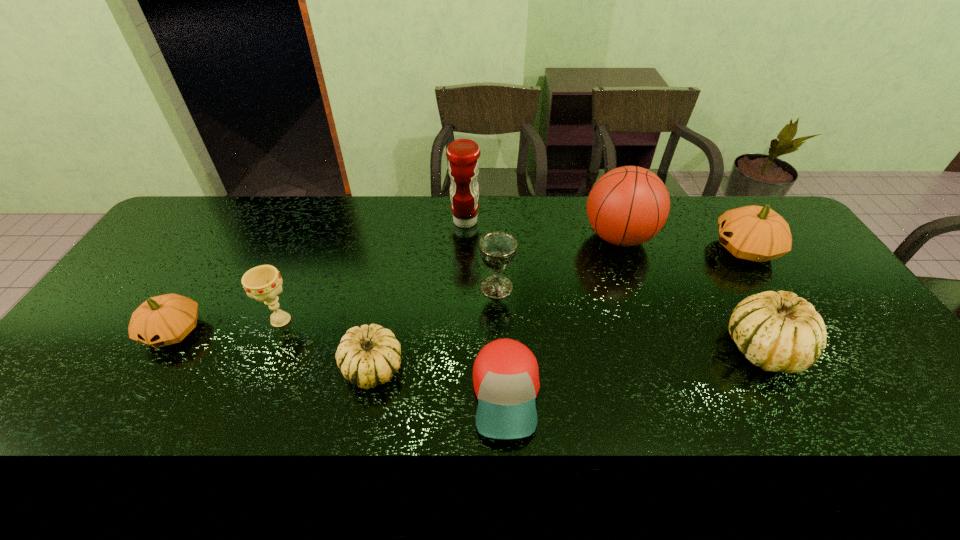
At what (x,y) coordinates should I click in order to perform the action: click on free spot between the eighth object from right to left and the seventh object from left to right. Please return your answer as a coordinate pair (x, y). The image size is (960, 540). Looking at the image, I should click on (450, 279).

At what (x,y) coordinates should I click in order to perform the action: click on vacant area between the baseball cap and the right orange gourd. Please return your answer as a coordinate pair (x, y). The height and width of the screenshot is (540, 960). Looking at the image, I should click on (625, 322).

Locate an element on the screen. vacant space that's between the bigger white gourd and the basketball is located at coordinates click(690, 293).

The image size is (960, 540). In order to click on vacant region between the red condiment and the leftmost gourd in this screenshot , I will do `click(320, 276)`.

Where is `the third closest object to the farther orange gourd`? This screenshot has width=960, height=540. the third closest object to the farther orange gourd is located at coordinates (497, 249).

Find the location of a particular element. This screenshot has width=960, height=540. object that is the closest to the bigger white gourd is located at coordinates (754, 233).

Find the location of a particular element. This screenshot has width=960, height=540. the closest gourd relative to the smaller orange gourd is located at coordinates (368, 356).

Identify which gourd is the second closest to the seventh object from left to right. Please provide its 2D coordinates. Your answer should be formatted as a tuple, i.e. [(x, y)], where the tuple contains the x and y coordinates of a point satisfying the conditions above.

[(778, 331)]

Locate an element on the screen. The height and width of the screenshot is (540, 960). free region that satisfies the following two spatial constraints: 1. on the side of the right white gourd with the carved face; 2. on the left side of the leftmost object is located at coordinates (163, 348).

Where is `free location that satisfies the following two spatial constraints: 1. on the side of the nearer orange gourd with the carved face; 2. on the left side of the smaller white gourd`? free location that satisfies the following two spatial constraints: 1. on the side of the nearer orange gourd with the carved face; 2. on the left side of the smaller white gourd is located at coordinates (152, 368).